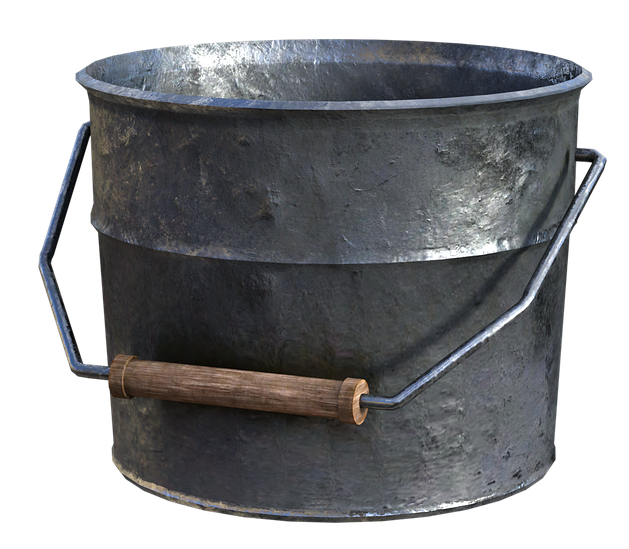
At what (x,y) coordinates should I click in order to perform the action: click on horizontal piece of wooden handle. Please return your answer as a coordinate pair (x, y). The width and height of the screenshot is (629, 549). Looking at the image, I should click on (253, 388).